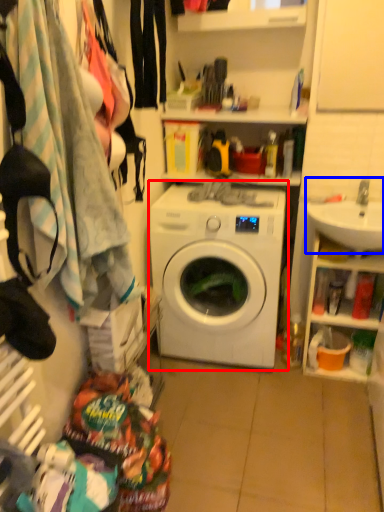
Question: Which object appears farthest to the camera in this image, washing machine (highlighted by a red box) or sink (highlighted by a blue box)?

Choices:
 (A) washing machine
 (B) sink

Answer: (A)